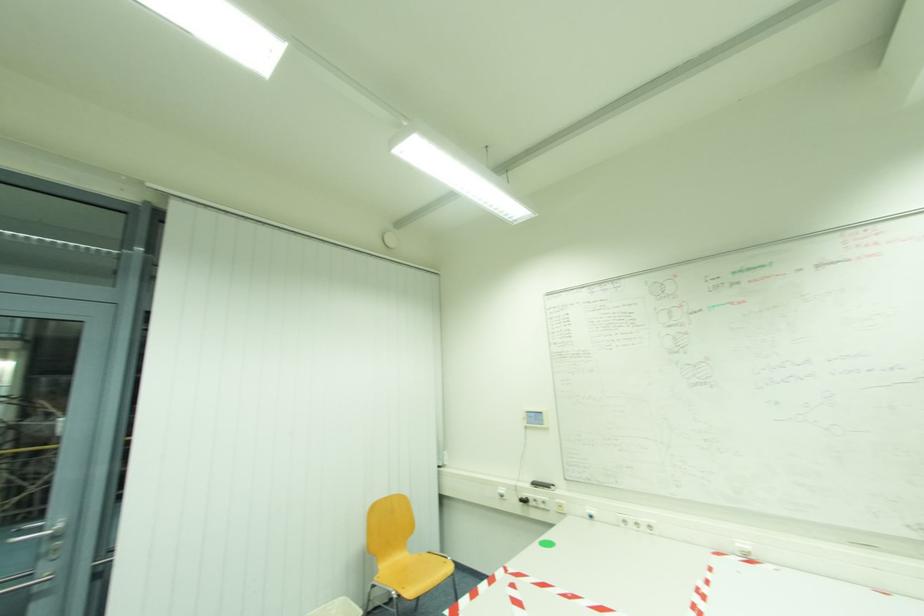
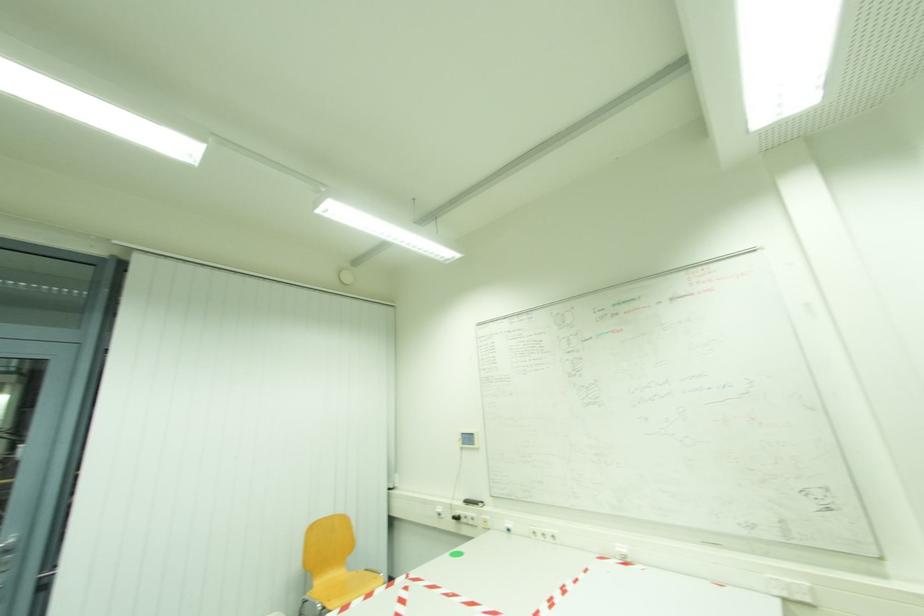
The images are taken continuously from a first-person perspective. In which direction are you moving?

The movement direction of the cameraman is right, backward.